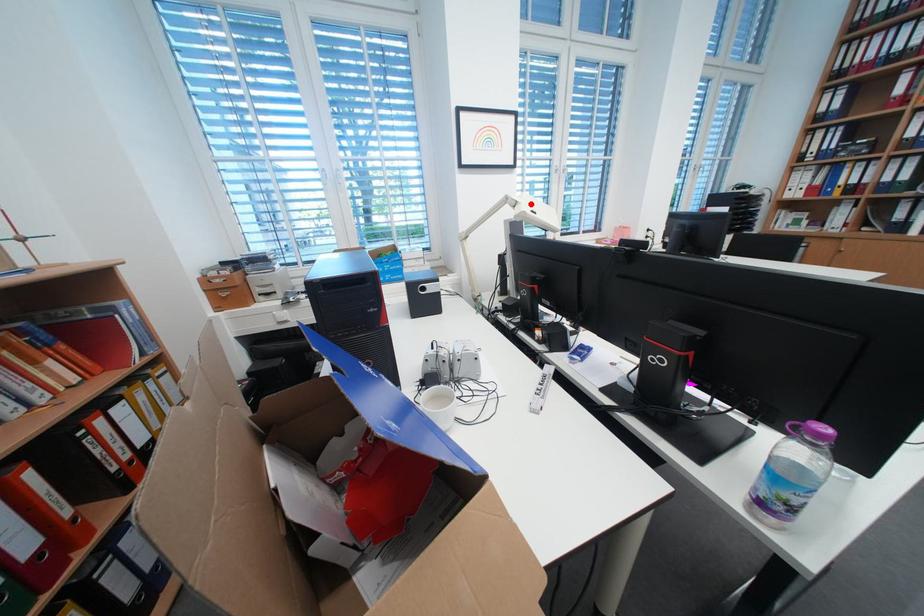
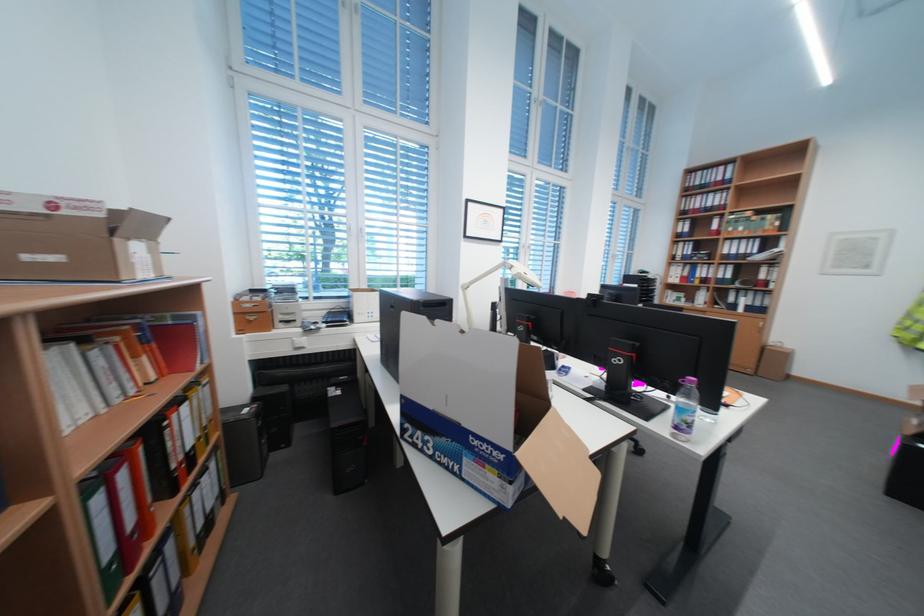
Where in the second image is the point corresponding to the highlighted location from the first image?

(526, 268)